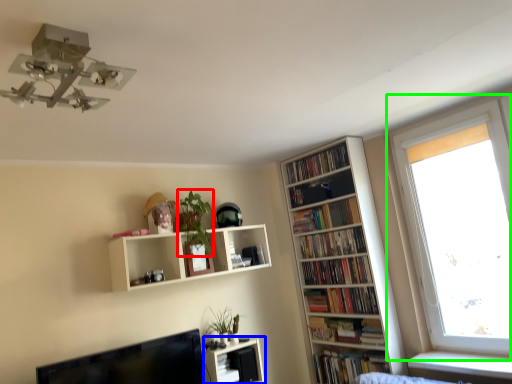
Question: Which object is the farthest from plant (highlighted by a red box)? Choose among these: shelf (highlighted by a blue box) or window (highlighted by a green box).

Choices:
 (A) shelf
 (B) window

Answer: (B)